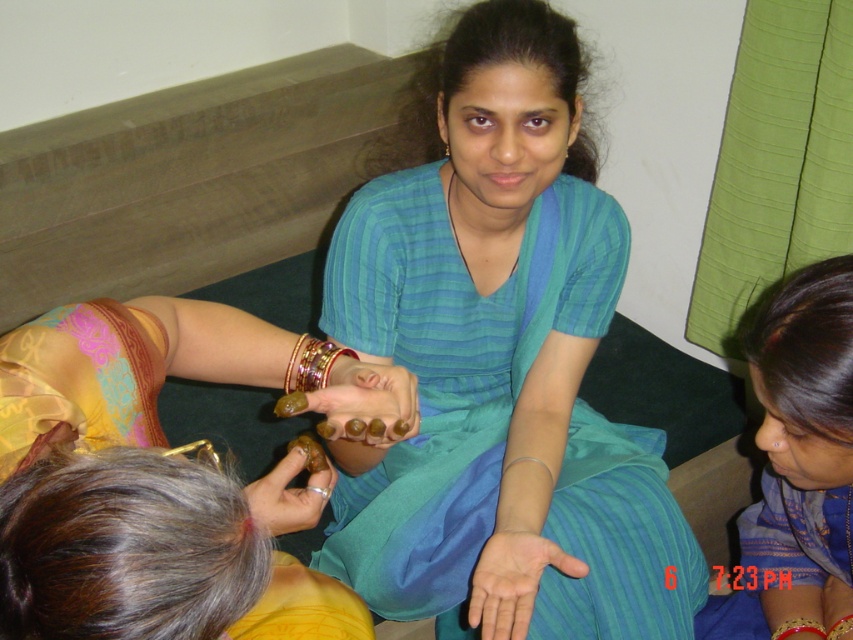
In the scene, you see the gold metallic bangles at center and the gold metallic bracelet at center. Which one is positioned to the left?

The gold metallic bangles at center is to the left of the gold metallic bracelet at center.

You are a photographer trying to capture a closeup of the matte gold bangles at lower left. The camera you are using has a minimum focusing distance of 50 centimeters. Can you take the photo without moving the camera closer?

The matte gold bangles at lower left is 49.23 centimeters from camera, so yes, you can take the photo without moving the camera closer because the distance is within the minimum focusing distance of 50 centimeters.